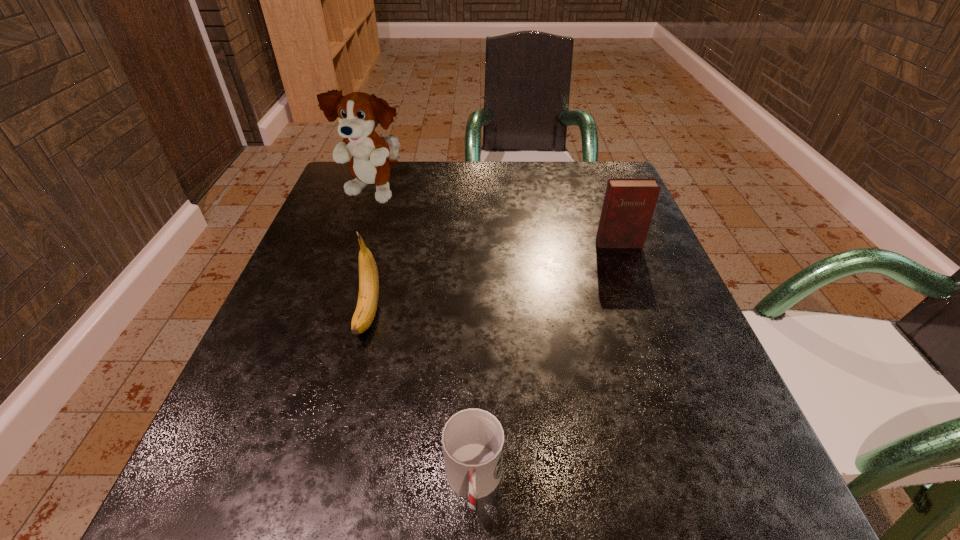
Identify the location of vacant space at the far left corner of the desktop. The image size is (960, 540). (361, 198).

Find the location of a particular element. vacant area at the far right corner of the desktop is located at coordinates (596, 170).

Identify the location of empty space between the second farthest object and the farthest object. The image size is (960, 540). (496, 219).

Where is `vacant area that lies between the third nearest object and the cup`? The image size is (960, 540). vacant area that lies between the third nearest object and the cup is located at coordinates (546, 363).

This screenshot has width=960, height=540. I want to click on free space between the second nearest object and the rightmost object, so click(493, 279).

Locate an element on the screen. The image size is (960, 540). empty space that is in between the third nearest object and the puppy is located at coordinates (496, 219).

Where is `vacant space that is in between the tallest object and the shortest object`? This screenshot has width=960, height=540. vacant space that is in between the tallest object and the shortest object is located at coordinates click(423, 339).

What are the coordinates of `free space between the puppy and the second farthest object` in the screenshot? It's located at (496, 219).

This screenshot has height=540, width=960. I want to click on free spot between the rightmost object and the tallest object, so click(x=496, y=219).

This screenshot has width=960, height=540. Find the location of `free spot between the second farthest object and the nearest object`. free spot between the second farthest object and the nearest object is located at coordinates (546, 363).